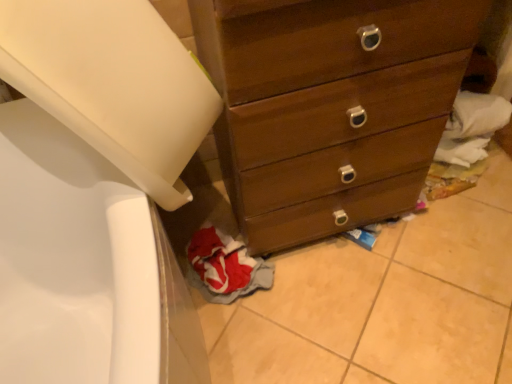
Question: From the image's perspective, is wooden chest of drawers at center above or below red fabric clothes at lower left?

Choices:
 (A) below
 (B) above

Answer: (B)

Question: Is wooden chest of drawers at center taller or shorter than red fabric clothes at lower left?

Choices:
 (A) tall
 (B) short

Answer: (A)

Question: Relative to red fabric clothes at lower left, is wooden chest of drawers at center in front or behind?

Choices:
 (A) front
 (B) behind

Answer: (A)

Question: From the image's perspective, is red fabric clothes at lower left positioned above or below wooden chest of drawers at center?

Choices:
 (A) above
 (B) below

Answer: (B)

Question: From a real-world perspective, is red fabric clothes at lower left above or below wooden chest of drawers at center?

Choices:
 (A) below
 (B) above

Answer: (A)

Question: Considering the positions of red fabric clothes at lower left and wooden chest of drawers at center in the image, is red fabric clothes at lower left bigger or smaller than wooden chest of drawers at center?

Choices:
 (A) small
 (B) big

Answer: (A)

Question: Is red fabric clothes at lower left to the left or to the right of wooden chest of drawers at center in the image?

Choices:
 (A) left
 (B) right

Answer: (A)